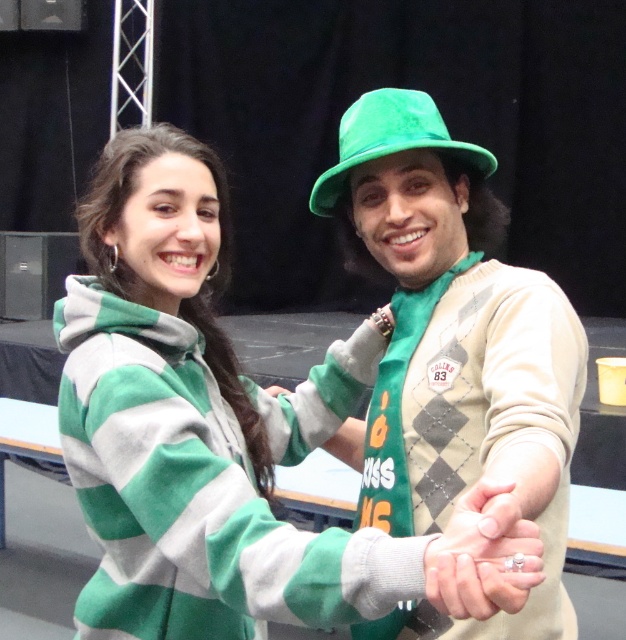
Question: Which point is farther to the camera?

Choices:
 (A) green felt hat at upper right
 (B) matte gold ring at center
 (C) velvet green hat at center

Answer: (C)

Question: Does green felt hat at upper right have a lesser width compared to green fleece hoodie at center?

Choices:
 (A) no
 (B) yes

Answer: (B)

Question: Observing the image, what is the correct spatial positioning of green felt hat at upper right in reference to matte gold ring at center?

Choices:
 (A) right
 (B) left

Answer: (A)

Question: Among these points, which one is farthest from the camera?

Choices:
 (A) (473, 196)
 (B) (439, 602)
 (C) (391, 116)
 (D) (103, 621)

Answer: (A)

Question: Does green fleece hoodie at center come behind velvet green hat at center?

Choices:
 (A) no
 (B) yes

Answer: (A)

Question: Which point is closer to the camera taking this photo?

Choices:
 (A) (130, 428)
 (B) (314, 394)

Answer: (A)